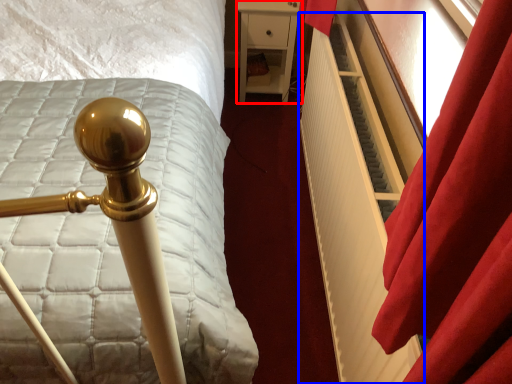
Question: Which object appears closest to the camera in this image, furniture (highlighted by a red box) or radiator (highlighted by a blue box)?

Choices:
 (A) furniture
 (B) radiator

Answer: (B)